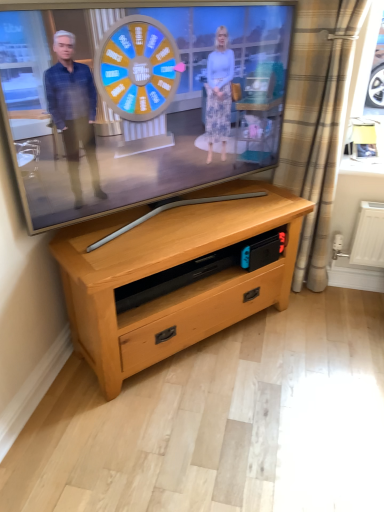
You are a GUI agent. You are given a task and a screenshot of the screen. Output one action in this format:
    pyautogui.click(x=<x>, y=<y>)
    Task: Click on the matte wooden tv at center
    
    Given the screenshot: What is the action you would take?
    pyautogui.click(x=139, y=103)

Consider the image. Measure the distance between point (178, 341) and camera.

The depth of point (178, 341) is 1.73 meters.

Where is `beige plaid curtain at right`? beige plaid curtain at right is located at coordinates (317, 122).

Is matte wooden tv at center completely or partially outside of beige plaid curtain at right?

matte wooden tv at center is positioned outside beige plaid curtain at right.

Between matte wooden tv at center and beige plaid curtain at right, which one has smaller size?

With smaller size is beige plaid curtain at right.

Is matte wooden tv at center taller than beige plaid curtain at right?

In fact, matte wooden tv at center may be shorter than beige plaid curtain at right.

From the image's perspective, between matte wooden tv at center and beige plaid curtain at right, which one is located above?

matte wooden tv at center.

Consider the image. Considering the relative sizes of matte wooden tv at center and light wood chest of drawers at center in the image provided, is matte wooden tv at center wider than light wood chest of drawers at center?

No.

Is matte wooden tv at center oriented towards light wood chest of drawers at center?

No, matte wooden tv at center is not aimed at light wood chest of drawers at center.

Does matte wooden tv at center contain light wood chest of drawers at center?

No, matte wooden tv at center does not contain light wood chest of drawers at center.

From the picture: From the image's perspective, is matte wooden tv at center over light wood chest of drawers at center?

Correct, matte wooden tv at center appears higher than light wood chest of drawers at center in the image.

Can you confirm if light wood chest of drawers at center is bigger than beige plaid curtain at right?

Correct, light wood chest of drawers at center is larger in size than beige plaid curtain at right.

Between point (179, 295) and point (293, 147), which one is positioned behind?

The point (293, 147) is farther from the camera.

How distant is light wood chest of drawers at center from beige plaid curtain at right?

light wood chest of drawers at center and beige plaid curtain at right are 22.85 inches apart.

At what (x,y) coordinates should I click in order to perform the action: click on curtain behind the light wood chest of drawers at center. Please return your answer as a coordinate pair (x, y). The height and width of the screenshot is (512, 384). Looking at the image, I should click on (317, 122).

This screenshot has width=384, height=512. I want to click on television in front of the beige plaid curtain at right, so click(139, 103).

Is beige plaid curtain at right next to matte wooden tv at center and touching it?

No, beige plaid curtain at right is not touching matte wooden tv at center.

From a real-world perspective, does beige plaid curtain at right sit lower than matte wooden tv at center?

Yes, from a real-world perspective, beige plaid curtain at right is below matte wooden tv at center.

Does beige plaid curtain at right have a larger size compared to matte wooden tv at center?

Incorrect, beige plaid curtain at right is not larger than matte wooden tv at center.

Is light wood chest of drawers at center completely or partially outside of matte wooden tv at center?

light wood chest of drawers at center lies outside matte wooden tv at center's area.

Does light wood chest of drawers at center come in front of matte wooden tv at center?

No, the depth of light wood chest of drawers at center is greater than that of matte wooden tv at center.

Which of these two, light wood chest of drawers at center or matte wooden tv at center, is smaller?

matte wooden tv at center is smaller.

Is light wood chest of drawers at center not near matte wooden tv at center?

Actually, light wood chest of drawers at center and matte wooden tv at center are a little close together.

Is beige plaid curtain at right at the right side of light wood chest of drawers at center?

Indeed, beige plaid curtain at right is positioned on the right side of light wood chest of drawers at center.

Is beige plaid curtain at right wider than light wood chest of drawers at center?

Incorrect, the width of beige plaid curtain at right does not surpass that of light wood chest of drawers at center.

Where is `curtain below the matte wooden tv at center (from the image's perspective)`? The width and height of the screenshot is (384, 512). curtain below the matte wooden tv at center (from the image's perspective) is located at coordinates (317, 122).

Identify the location of chest of drawers that appears on the right of matte wooden tv at center. (172, 276).

From the image, which object appears to be farther from matte wooden tv at center, beige plaid curtain at right or light wood chest of drawers at center?

Based on the image, beige plaid curtain at right appears to be further to matte wooden tv at center.

From the image, which object appears to be nearer to light wood chest of drawers at center, beige plaid curtain at right or matte wooden tv at center?

matte wooden tv at center lies closer to light wood chest of drawers at center than the other object.

Which object lies nearer to the anchor point light wood chest of drawers at center, matte wooden tv at center or beige plaid curtain at right?

The object closer to light wood chest of drawers at center is matte wooden tv at center.

From the picture: From the image, which object appears to be farther from beige plaid curtain at right, light wood chest of drawers at center or matte wooden tv at center?

light wood chest of drawers at center is further to beige plaid curtain at right.

From the image, which object appears to be nearer to beige plaid curtain at right, matte wooden tv at center or light wood chest of drawers at center?

matte wooden tv at center is closer to beige plaid curtain at right.

From the image, which object appears to be farther from matte wooden tv at center, light wood chest of drawers at center or beige plaid curtain at right?

Among the two, beige plaid curtain at right is located further to matte wooden tv at center.

Locate an element on the screen. This screenshot has height=512, width=384. chest of drawers between matte wooden tv at center and beige plaid curtain at right from left to right is located at coordinates (172, 276).